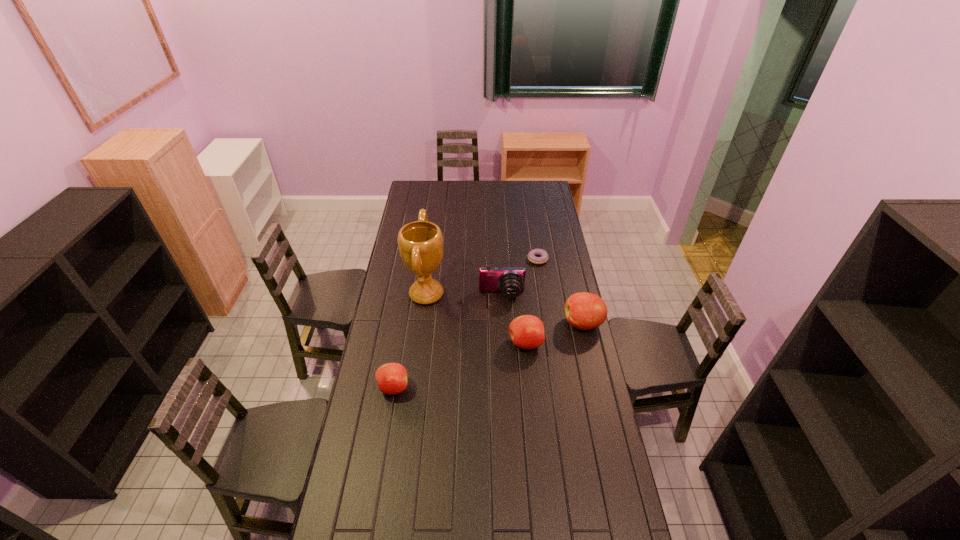
The image size is (960, 540). In order to click on the leftmost apple in this screenshot , I will do `click(391, 378)`.

The width and height of the screenshot is (960, 540). Find the location of `the nearest object`. the nearest object is located at coordinates (391, 378).

At what (x,y) coordinates should I click in order to perform the action: click on the second apple from left to right. Please return your answer as a coordinate pair (x, y). This screenshot has height=540, width=960. Looking at the image, I should click on (526, 331).

You are a GUI agent. You are given a task and a screenshot of the screen. Output one action in this format:
    pyautogui.click(x=<x>, y=<y>)
    Task: Click on the rightmost object
    The width and height of the screenshot is (960, 540).
    Given the screenshot: What is the action you would take?
    pyautogui.click(x=585, y=311)

Where is `award`? This screenshot has height=540, width=960. award is located at coordinates point(420,243).

At what (x,y) coordinates should I click in order to perform the action: click on the shortest object. Please return your answer as a coordinate pair (x, y). This screenshot has height=540, width=960. Looking at the image, I should click on (532, 254).

This screenshot has width=960, height=540. Identify the location of the farthest object. (532, 254).

Where is `camera`? The height and width of the screenshot is (540, 960). camera is located at coordinates (510, 281).

Where is `vacant space situated 0.400m on the front of the nearest object`? vacant space situated 0.400m on the front of the nearest object is located at coordinates (372, 510).

The width and height of the screenshot is (960, 540). Identify the location of free space located 0.310m on the back of the second apple from right to left. (519, 284).